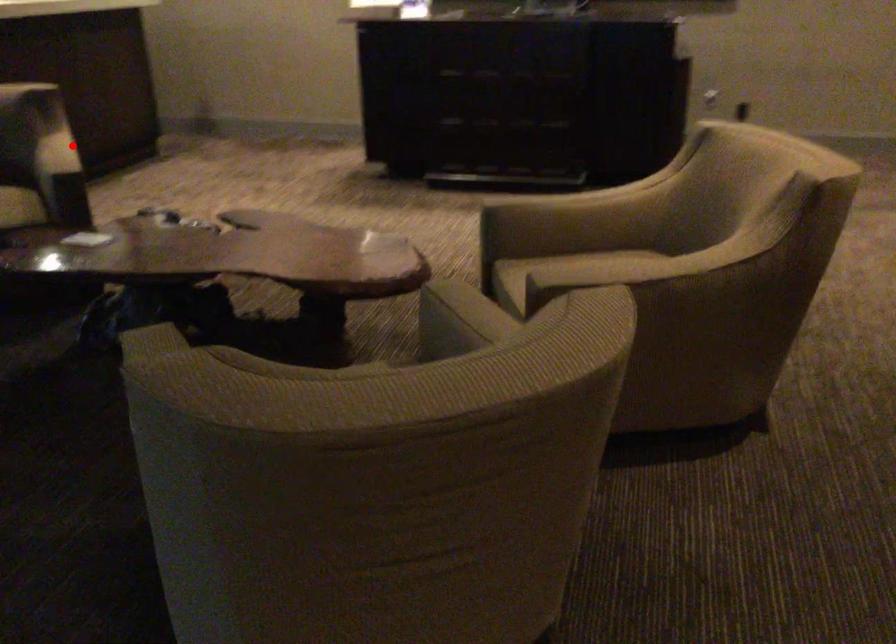
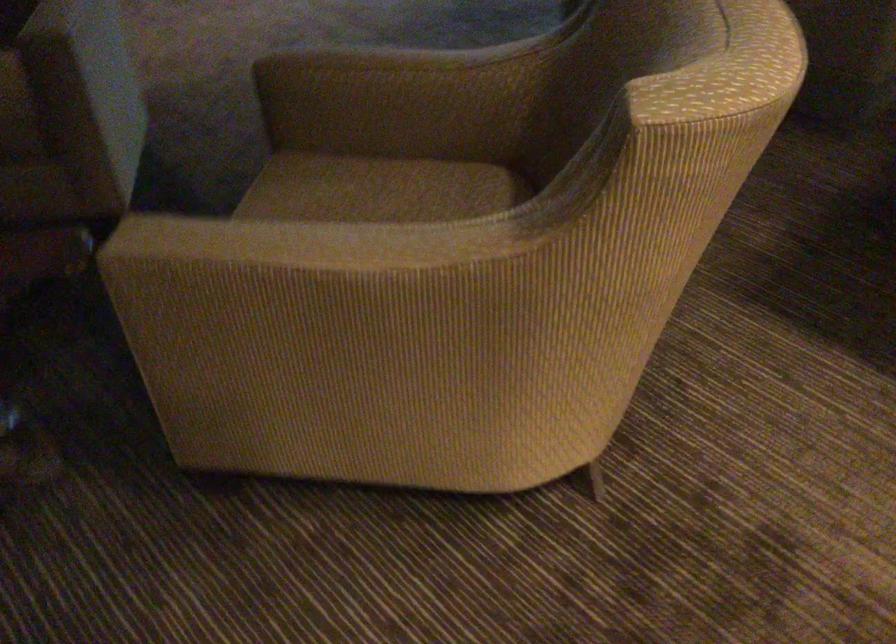
The point at the highlighted location is marked in the first image. Where is the corresponding point in the second image?

(298, 243)